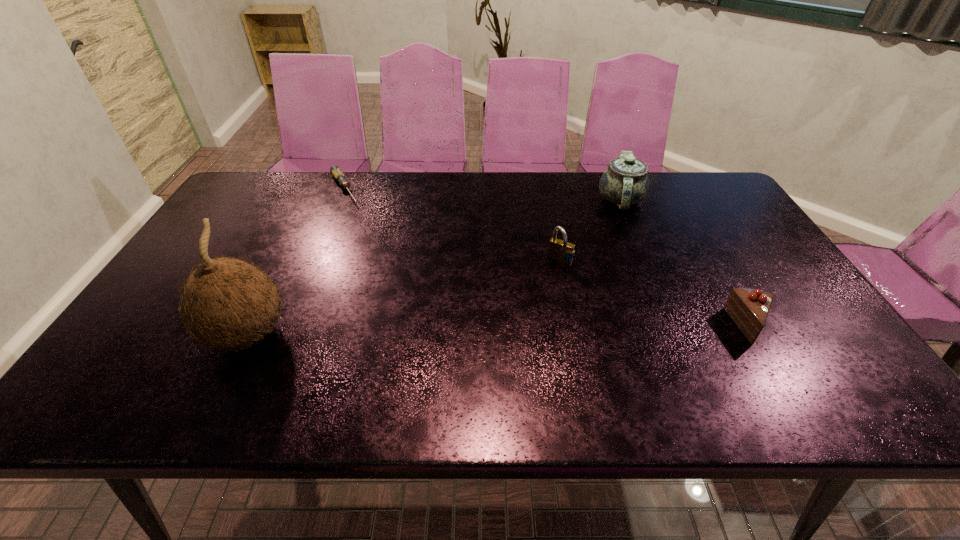
Where is `vacant space at the far right corner of the desktop`? vacant space at the far right corner of the desktop is located at coordinates (682, 180).

Where is `unoccupied area between the fourth tallest object and the screwdriver`? This screenshot has height=540, width=960. unoccupied area between the fourth tallest object and the screwdriver is located at coordinates (547, 257).

The image size is (960, 540). In order to click on free area in between the tallest object and the padlock in this screenshot , I will do `click(404, 298)`.

Image resolution: width=960 pixels, height=540 pixels. In order to click on free spot between the fourth tallest object and the coconut in this screenshot , I will do `click(499, 330)`.

Find the location of a particular element. Image resolution: width=960 pixels, height=540 pixels. vacant area that lies between the third nearest object and the coconut is located at coordinates coord(404,298).

Where is `vacant space in between the third shortest object and the chinaware`? The width and height of the screenshot is (960, 540). vacant space in between the third shortest object and the chinaware is located at coordinates (590, 231).

Image resolution: width=960 pixels, height=540 pixels. Identify the location of free point between the screwdriver and the chinaware. (483, 194).

Where is `free space between the screwdriver and the chinaware`? free space between the screwdriver and the chinaware is located at coordinates (483, 194).

The height and width of the screenshot is (540, 960). I want to click on free spot between the chocolate cake and the screwdriver, so click(x=547, y=257).

Locate an element on the screen. The image size is (960, 540). empty location between the tallest object and the padlock is located at coordinates (404, 298).